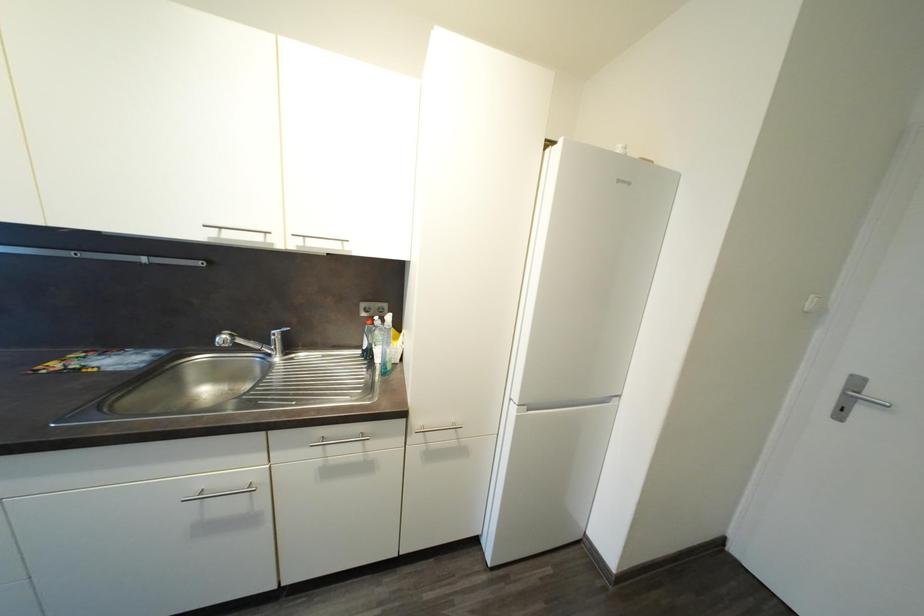
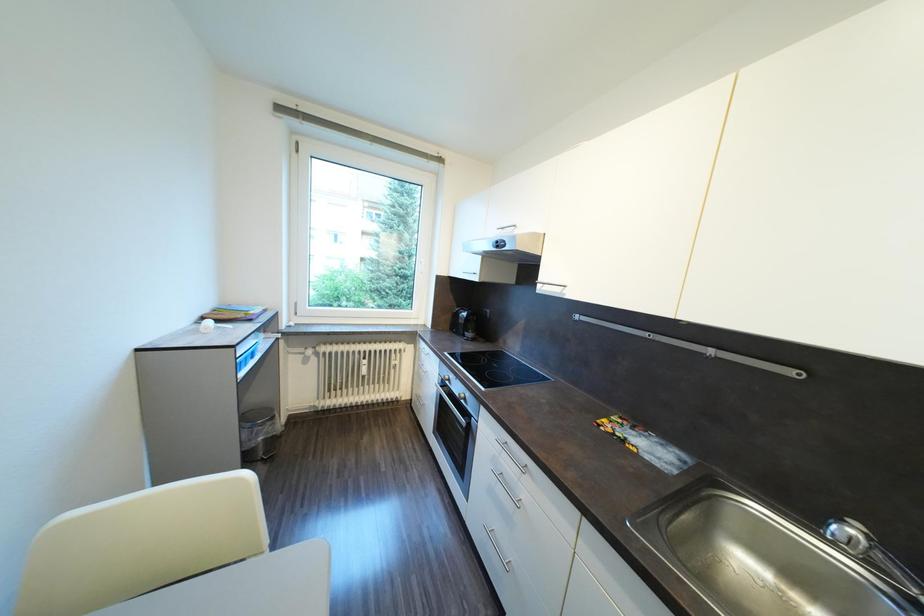
Question: The camera is either moving clockwise (left) or counter-clockwise (right) around the object. The first image is from the beginning of the video and the second image is from the end. Is the camera moving left or right when shooting the video?

Choices:
 (A) Left
 (B) Right

Answer: (B)